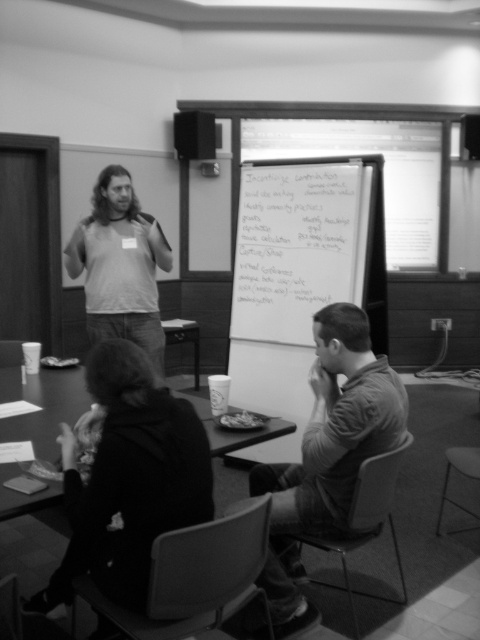
What is the exact coordinate of the matte gray tank top at center?

The matte gray tank top at center is located at point (120, 266).

You are standing at the speaker mounted above the whiteboard in the conference room. You need to point to two specific points on the table. The first point is at coordinates point (135, 364) and the second point is at coordinates point (1, 477). Which of these two points is closer to you?

Point (135, 364) is in front of point (1, 477), so it is closer to you.

You are organizing a meeting and need to place a name tag on the table. Can you put it on the smooth plastic table at lower center without covering the matte gray tank top at center?

The matte gray tank top at center is positioned over the smooth plastic table at lower center, so placing the name tag on the table would require placing it under the tank top or on an uncovered area of the table.